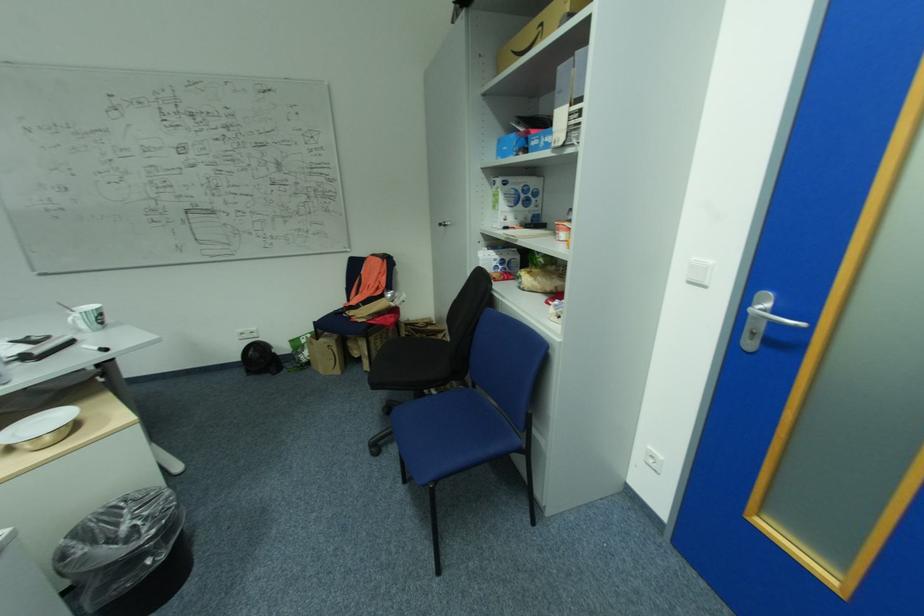
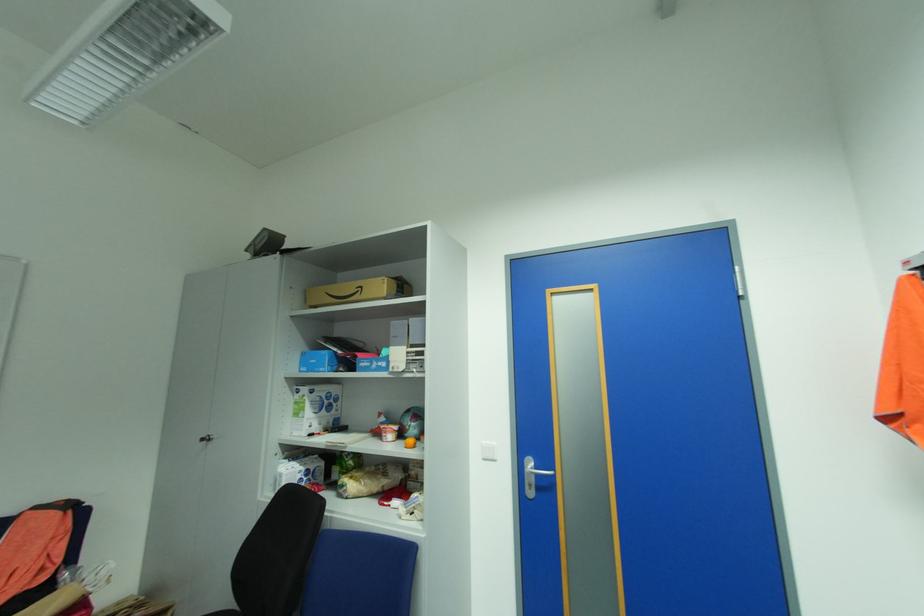
Locate, in the second image, the point that corresponds to (x=696, y=283) in the first image.

(492, 460)